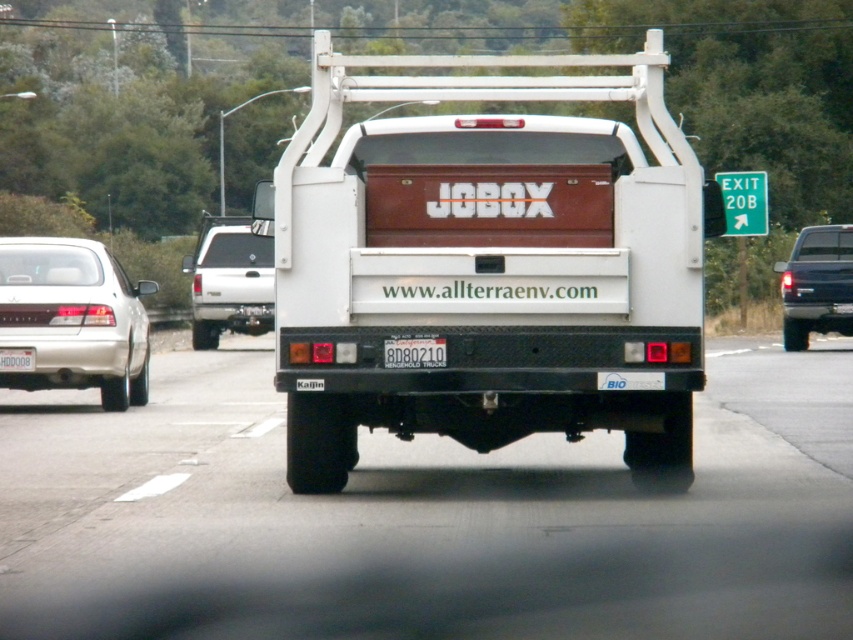
Question: Which point is farther to the camera?

Choices:
 (A) black plastic license plate at center
 (B) satin silver sedan at left
 (C) white matte truck at left
 (D) white plastic license plate at center

Answer: (B)

Question: Does white matte truck at center come behind black plastic license plate at center?

Choices:
 (A) no
 (B) yes

Answer: (A)

Question: Can you confirm if white matte truck at center is positioned to the right of glossy black truck at right?

Choices:
 (A) no
 (B) yes

Answer: (A)

Question: Can you confirm if glossy black truck at right is thinner than white plastic license plate at center?

Choices:
 (A) no
 (B) yes

Answer: (B)

Question: Which point is farther to the camera?

Choices:
 (A) white plastic license plate at center
 (B) black metal truck bed at center

Answer: (A)

Question: Based on their relative distances, which object is nearer to the white plastic license plate at center?

Choices:
 (A) satin silver sedan at left
 (B) white matte truck at center

Answer: (A)